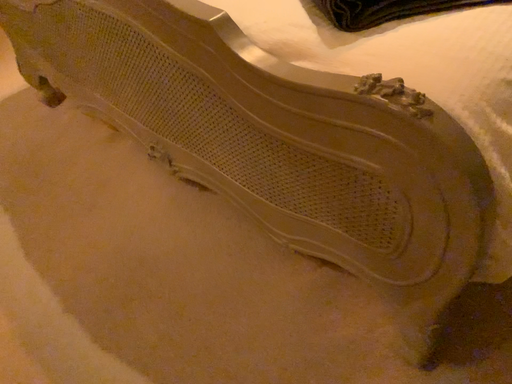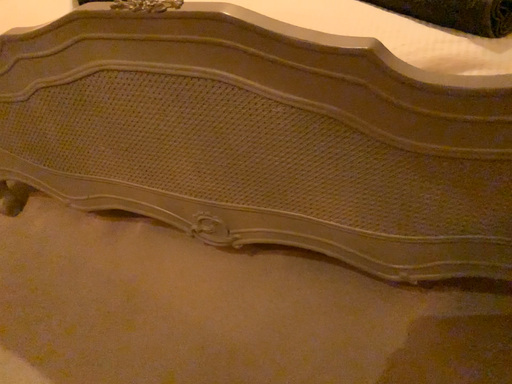
Question: Which way did the camera rotate in the video?

Choices:
 (A) rotated right
 (B) rotated left

Answer: (A)